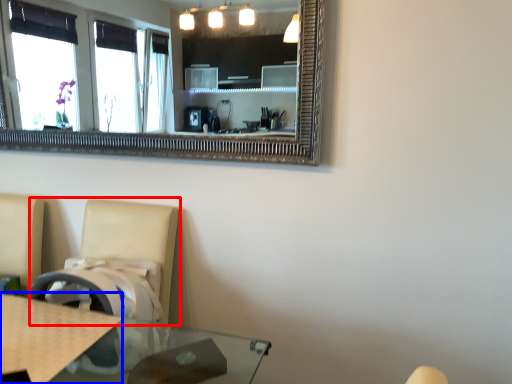
Question: Which of the following is the closest to the observer, swivel chair (highlighted by a red box) or counter top (highlighted by a blue box)?

Choices:
 (A) swivel chair
 (B) counter top

Answer: (B)